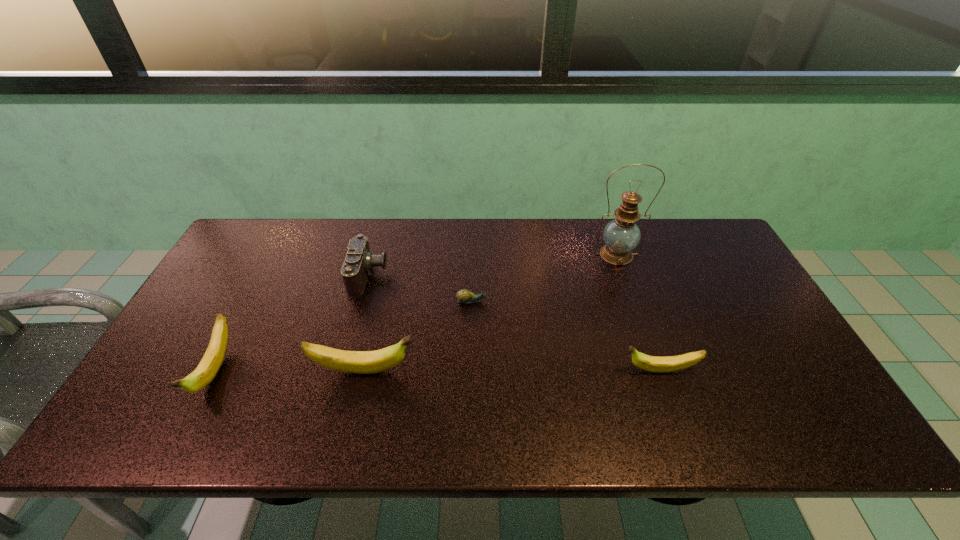
Where is `the leftmost banana`? the leftmost banana is located at coordinates (210, 364).

This screenshot has height=540, width=960. Identify the location of the second tallest banana. (210, 364).

The height and width of the screenshot is (540, 960). I want to click on the second banana from right to left, so click(x=361, y=362).

Where is `the shortest banana`? the shortest banana is located at coordinates (656, 364).

This screenshot has width=960, height=540. What are the coordinates of `the tallest object` in the screenshot? It's located at (621, 235).

Find the location of a particular element. camera is located at coordinates (359, 260).

Find the location of a particular element. The height and width of the screenshot is (540, 960). the shortest object is located at coordinates (465, 296).

The width and height of the screenshot is (960, 540). What are the coordinates of `the third object from right to left` in the screenshot? It's located at (465, 296).

I want to click on free spot located 0.100m at the stem of the second banana from right to left, so click(457, 371).

Find the location of a particular element. The height and width of the screenshot is (540, 960). vacant space located at the stem of the rightmost banana is located at coordinates (586, 370).